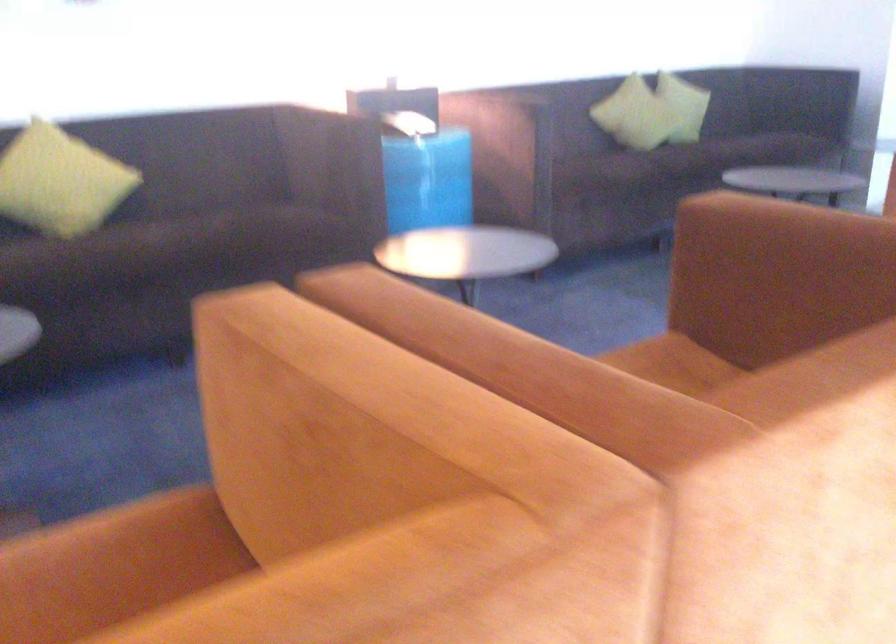
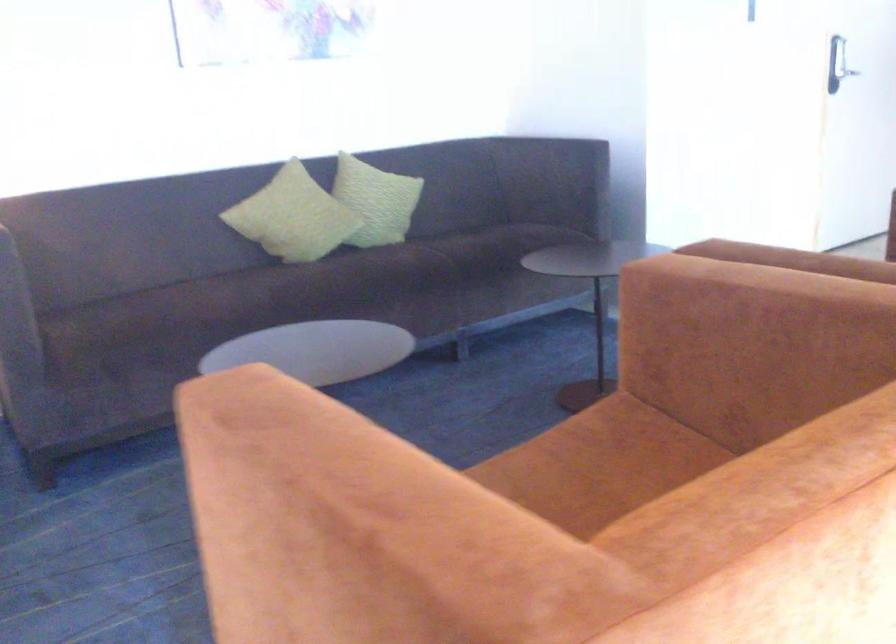
Where in the second image is the point corresponding to (729,86) from the first image?

(375, 201)